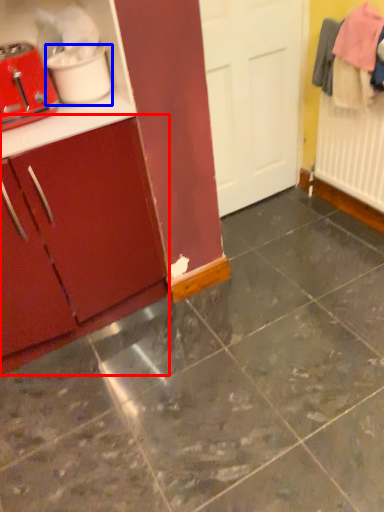
Question: Which of the following is the closest to the observer, cabinetry (highlighted by a red box) or appliance (highlighted by a blue box)?

Choices:
 (A) cabinetry
 (B) appliance

Answer: (A)